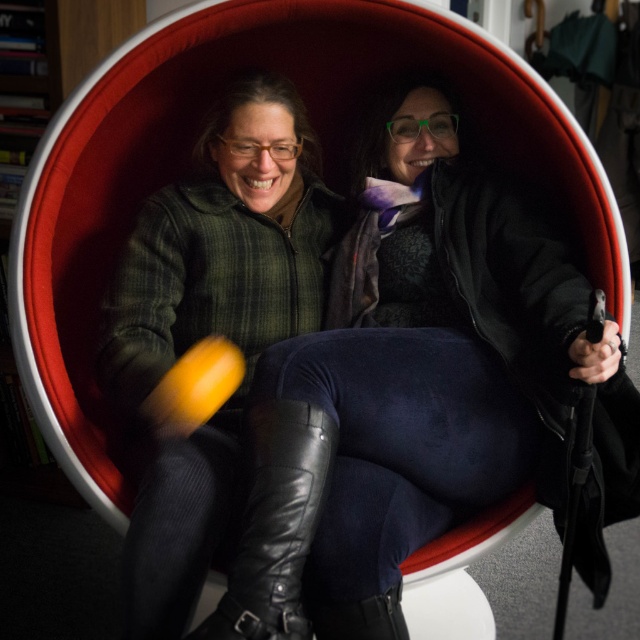
Question: Which point is farther to the camera?

Choices:
 (A) black leather boot at center
 (B) green plaid jacket at left

Answer: (B)

Question: Is green plaid jacket at left closer to the viewer compared to black leather boot at center?

Choices:
 (A) yes
 (B) no

Answer: (B)

Question: Does green plaid jacket at left have a larger size compared to black leather boot at center?

Choices:
 (A) yes
 (B) no

Answer: (A)

Question: Can you confirm if green plaid jacket at left is positioned below black leather boot at center?

Choices:
 (A) no
 (B) yes

Answer: (A)

Question: Which point appears farthest from the camera in this image?

Choices:
 (A) (332, 218)
 (B) (224, 616)

Answer: (A)